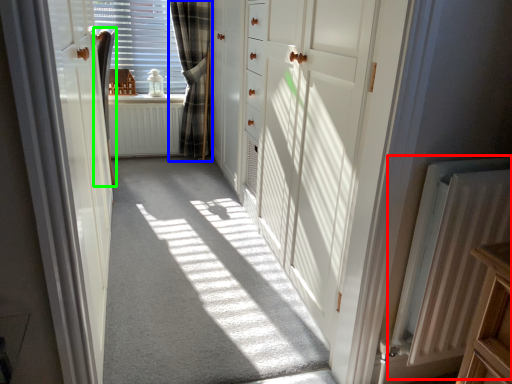
Question: Which object is positioned closest to radiator (highlighted by a red box)? Select from curtain (highlighted by a blue box) and curtain (highlighted by a green box).

Choices:
 (A) curtain
 (B) curtain

Answer: (B)